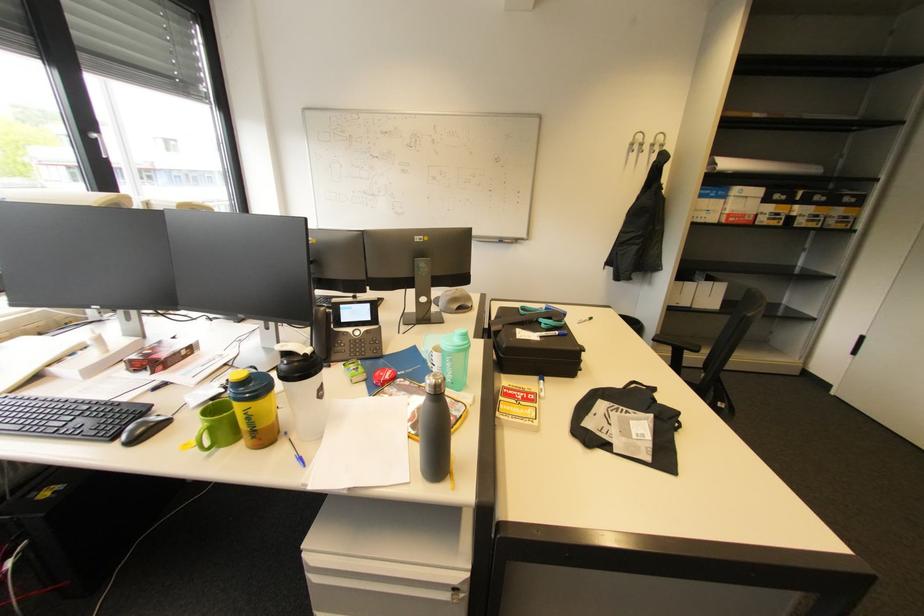
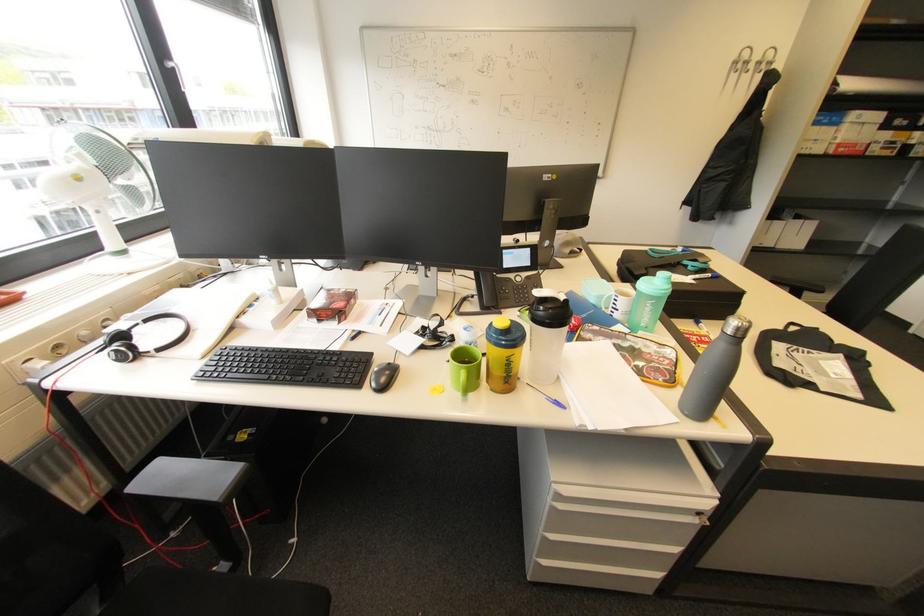
In the second image, find the point that corresponds to [239,381] in the first image.

(508, 328)